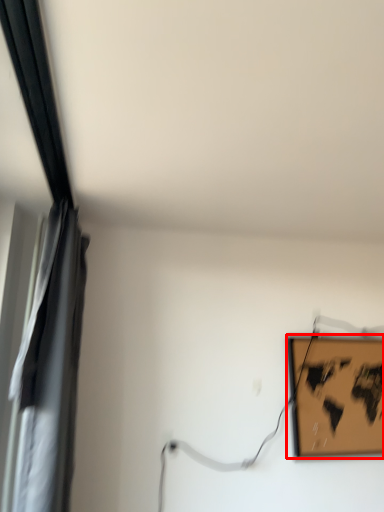
Question: From the image's perspective, where is picture frame (annotated by the red box) located in relation to curtain in the image?

Choices:
 (A) above
 (B) below

Answer: (B)